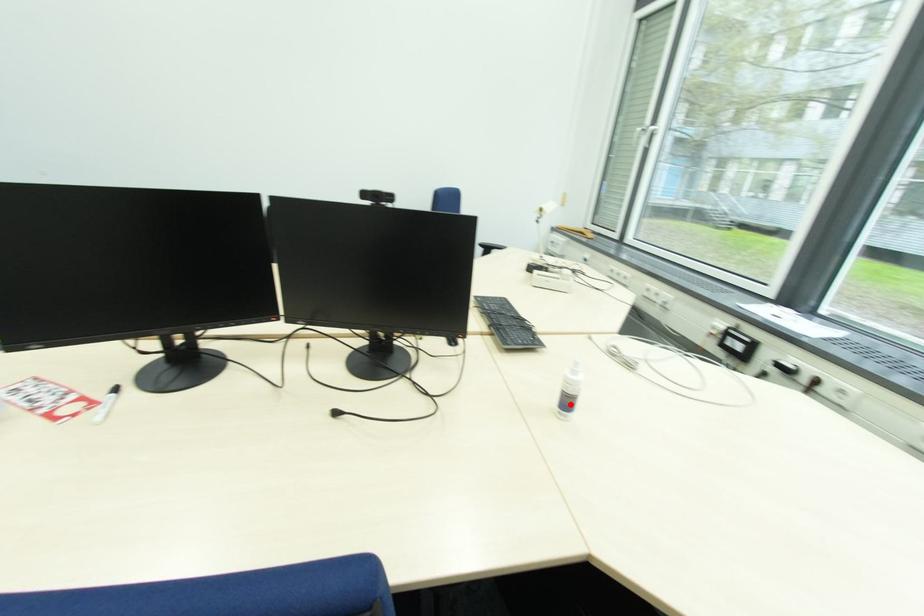
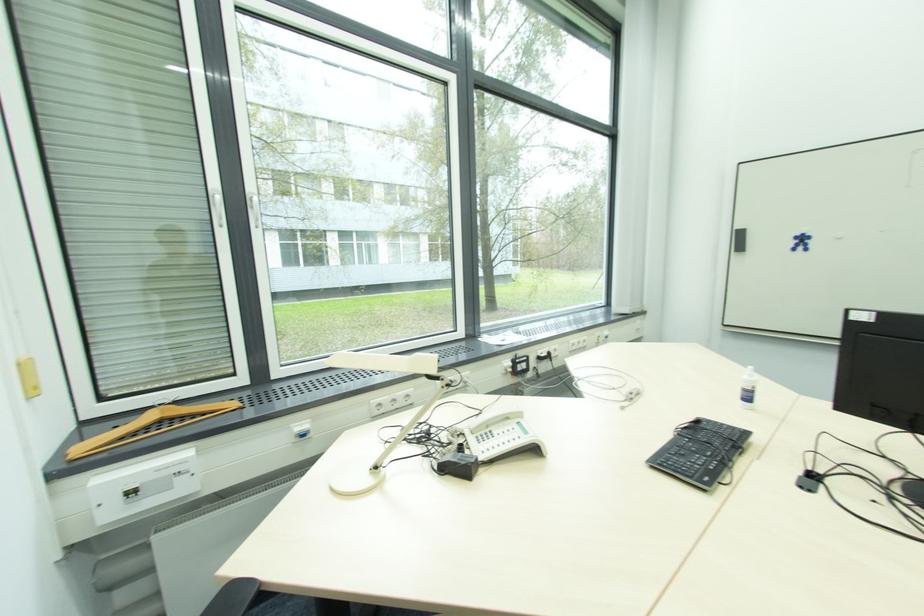
Find the pixel in the second image that matches the highlighted location in the first image.

(750, 400)